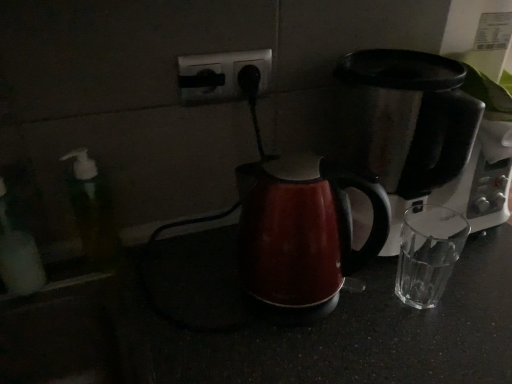
The height and width of the screenshot is (384, 512). Find the location of `translucent plastic soap dispenser at left`. translucent plastic soap dispenser at left is located at coordinates (93, 211).

The image size is (512, 384). I want to click on stainless steel coffee maker at right, so click(x=420, y=136).

Find the location of a particular element. Image resolution: width=512 pixels, height=384 pixels. black plastic outlet at center is located at coordinates (221, 74).

Is black plastic outlet at center bigger than translucent plastic soap dispenser at left?

Incorrect, black plastic outlet at center is not larger than translucent plastic soap dispenser at left.

Does black plastic outlet at center have a greater height compared to translucent plastic soap dispenser at left?

Incorrect, the height of black plastic outlet at center is not larger of that of translucent plastic soap dispenser at left.

Considering the positions of point (263, 60) and point (96, 267), is point (263, 60) closer or farther from the camera than point (96, 267)?

Point (263, 60).

From the image's perspective, is black plastic outlet at center below translucent plastic soap dispenser at left?

No.

Are translucent plastic soap dispenser at left and black plastic outlet at center located far from each other?

No.

Could you tell me if translucent plastic soap dispenser at left is turned towards black plastic outlet at center?

No.

From a real-world perspective, which is physically below, translucent plastic soap dispenser at left or black plastic outlet at center?

translucent plastic soap dispenser at left.

Is translucent plastic soap dispenser at left completely or partially outside of black plastic outlet at center?

Yes, translucent plastic soap dispenser at left is located beyond the bounds of black plastic outlet at center.

Considering the points (232, 97) and (470, 219), which point is behind, point (232, 97) or point (470, 219)?

The point (470, 219) is farther from the camera.

Considering the sizes of objects black plastic outlet at center and stainless steel coffee maker at right in the image provided, who is thinner, black plastic outlet at center or stainless steel coffee maker at right?

black plastic outlet at center is thinner.

From a real-world perspective, is black plastic outlet at center under stainless steel coffee maker at right?

Incorrect, from a real-world perspective, black plastic outlet at center is higher than stainless steel coffee maker at right.

From the image's perspective, is black plastic outlet at center above or below stainless steel coffee maker at right?

black plastic outlet at center is situated higher than stainless steel coffee maker at right in the image.

Find the location of a particular element. The image size is (512, 384). kettle that appears in front of the translucent plastic soap dispenser at left is located at coordinates (301, 236).

Does glossy plastic kettle at center contain translucent plastic soap dispenser at left?

Definitely not — translucent plastic soap dispenser at left is not inside glossy plastic kettle at center.

Measure the distance from glossy plastic kettle at center to translucent plastic soap dispenser at left.

They are 12.52 inches apart.

Does glossy plastic kettle at center have a smaller size compared to translucent plastic soap dispenser at left?

No, glossy plastic kettle at center is not smaller than translucent plastic soap dispenser at left.

Is black plastic outlet at center at the back of glossy plastic kettle at center?

Yes.

Which point is more distant from viewer, [330,181] or [257,85]?

The point [257,85] is behind.

From a real-world perspective, which object rests below the other?

glossy plastic kettle at center is physically lower.

Is glossy plastic kettle at center to the right of black plastic outlet at center from the viewer's perspective?

Correct, you'll find glossy plastic kettle at center to the right of black plastic outlet at center.

Can you tell me how much translucent plastic soap dispenser at left and stainless steel coffee maker at right differ in facing direction?

The facing directions of translucent plastic soap dispenser at left and stainless steel coffee maker at right are 0.00652 degrees apart.

Is stainless steel coffee maker at right at the back of translucent plastic soap dispenser at left?

That's not correct — translucent plastic soap dispenser at left is not looking away from stainless steel coffee maker at right.

Can you confirm if translucent plastic soap dispenser at left is taller than stainless steel coffee maker at right?

In fact, translucent plastic soap dispenser at left may be shorter than stainless steel coffee maker at right.

Considering the relative sizes of translucent plastic soap dispenser at left and stainless steel coffee maker at right in the image provided, is translucent plastic soap dispenser at left thinner than stainless steel coffee maker at right?

Correct, the width of translucent plastic soap dispenser at left is less than that of stainless steel coffee maker at right.

Is stainless steel coffee maker at right shorter than translucent plastic soap dispenser at left?

In fact, stainless steel coffee maker at right may be taller than translucent plastic soap dispenser at left.

Which object is thinner, stainless steel coffee maker at right or translucent plastic soap dispenser at left?

Thinner between the two is translucent plastic soap dispenser at left.

Is stainless steel coffee maker at right positioned with its back to translucent plastic soap dispenser at left?

stainless steel coffee maker at right is not turned away from translucent plastic soap dispenser at left.

Is translucent plastic soap dispenser at left inside stainless steel coffee maker at right?

No, stainless steel coffee maker at right does not contain translucent plastic soap dispenser at left.

I want to click on electric outlet behind the translucent plastic soap dispenser at left, so click(x=221, y=74).

The width and height of the screenshot is (512, 384). I want to click on electric outlet on the right of translucent plastic soap dispenser at left, so click(x=221, y=74).

Estimate the real-world distances between objects in this image. Which object is closer to translucent plastic soap dispenser at left, glossy plastic kettle at center or black plastic outlet at center?

black plastic outlet at center lies closer to translucent plastic soap dispenser at left than the other object.

Based on their spatial positions, is stainless steel coffee maker at right or black plastic outlet at center further from glossy plastic kettle at center?

The object further to glossy plastic kettle at center is black plastic outlet at center.

When comparing their distances from glossy plastic kettle at center, does black plastic outlet at center or stainless steel coffee maker at right seem closer?

stainless steel coffee maker at right lies closer to glossy plastic kettle at center than the other object.

Looking at the image, which one is located closer to glossy plastic kettle at center, black plastic outlet at center or translucent plastic soap dispenser at left?

black plastic outlet at center is positioned closer to the anchor glossy plastic kettle at center.

Based on the photo, estimate the real-world distances between objects in this image. Which object is further from glossy plastic kettle at center, translucent plastic soap dispenser at left or stainless steel coffee maker at right?

translucent plastic soap dispenser at left is further to glossy plastic kettle at center.

Looking at the image, which one is located closer to black plastic outlet at center, stainless steel coffee maker at right or translucent plastic soap dispenser at left?

translucent plastic soap dispenser at left.

Which object lies nearer to the anchor point black plastic outlet at center, stainless steel coffee maker at right or glossy plastic kettle at center?

glossy plastic kettle at center is positioned closer to the anchor black plastic outlet at center.

From the picture: Looking at the image, which one is located closer to translucent plastic soap dispenser at left, black plastic outlet at center or glossy plastic kettle at center?

Answer: Among the two, black plastic outlet at center is located nearer to translucent plastic soap dispenser at left.

You are a GUI agent. You are given a task and a screenshot of the screen. Output one action in this format:
    pyautogui.click(x=<x>, y=<y>)
    Task: Click on the kettle between black plastic outlet at center and stainless steel coffee maker at right in the horizontal direction
    The width and height of the screenshot is (512, 384).
    Given the screenshot: What is the action you would take?
    pyautogui.click(x=301, y=236)

Locate an element on the screen. electric outlet located between translucent plastic soap dispenser at left and glossy plastic kettle at center in the left-right direction is located at coordinates (221, 74).

Identify the location of electric outlet located between translucent plastic soap dispenser at left and stainless steel coffee maker at right in the left-right direction. (221, 74).

Locate an element on the screen. Image resolution: width=512 pixels, height=384 pixels. kettle between translucent plastic soap dispenser at left and stainless steel coffee maker at right in the horizontal direction is located at coordinates (301, 236).